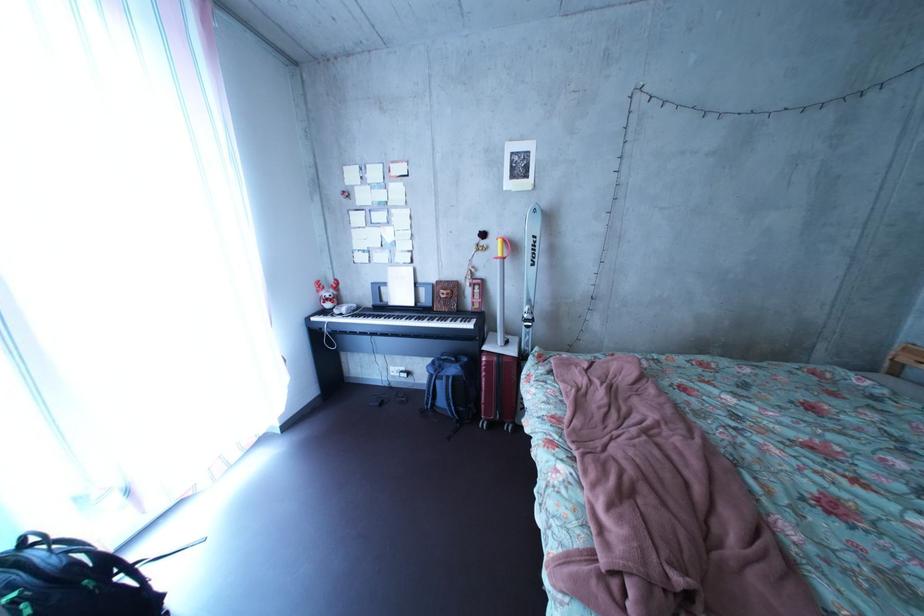
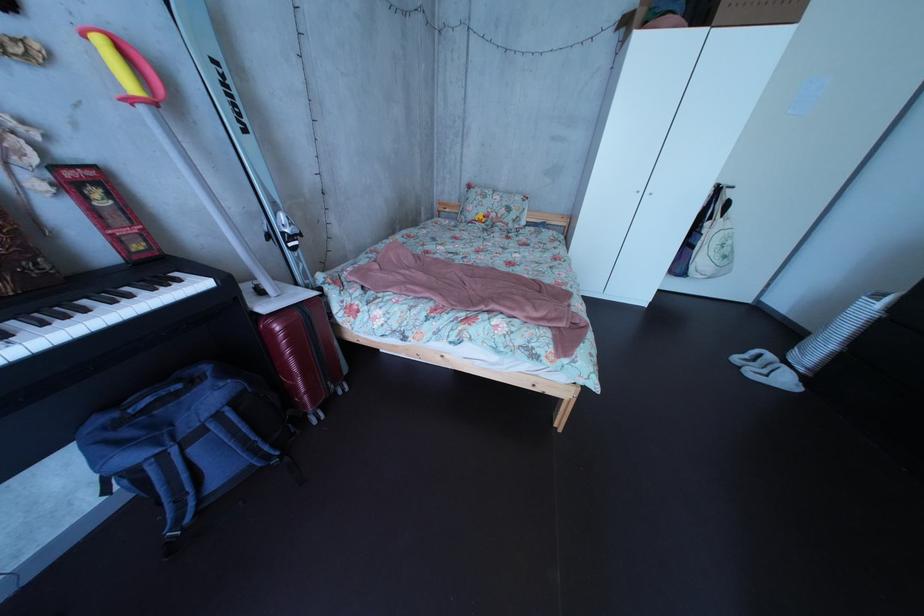
First-person continuous shooting, in which direction is the camera rotating?

The camera's rotation is toward right-down.